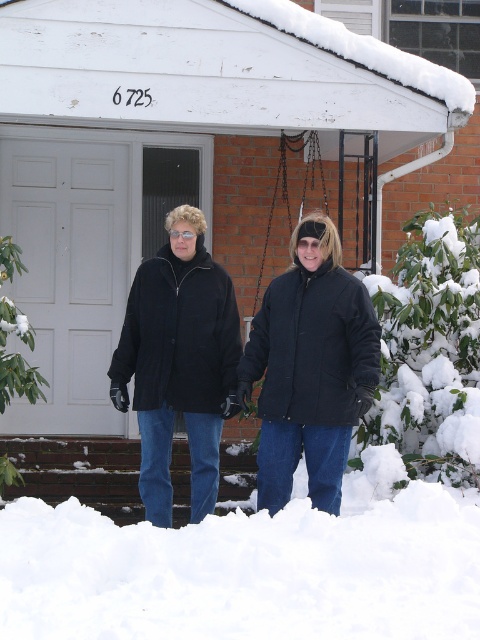
Question: Is black matte jackets at center to the left of black matte jacket at center from the viewer's perspective?

Choices:
 (A) no
 (B) yes

Answer: (A)

Question: Among these objects, which one is nearest to the camera?

Choices:
 (A) white fluffy snow at lower center
 (B) matte black jacket at center
 (C) black matte jackets at center
 (D) black matte jacket at center

Answer: (A)

Question: From the image, what is the correct spatial relationship of white fluffy snow at lower center in relation to matte black jacket at center?

Choices:
 (A) left
 (B) right

Answer: (A)

Question: Considering the relative positions of white fluffy snow at lower center and black matte jackets at center in the image provided, where is white fluffy snow at lower center located with respect to black matte jackets at center?

Choices:
 (A) above
 (B) below

Answer: (B)

Question: Which is farther from the matte black jacket at center?

Choices:
 (A) white fluffy snow at lower center
 (B) black matte jacket at center

Answer: (A)

Question: Based on their relative distances, which object is nearer to the black matte jackets at center?

Choices:
 (A) black matte jacket at center
 (B) white fluffy snow at lower center
 (C) matte black jacket at center

Answer: (C)